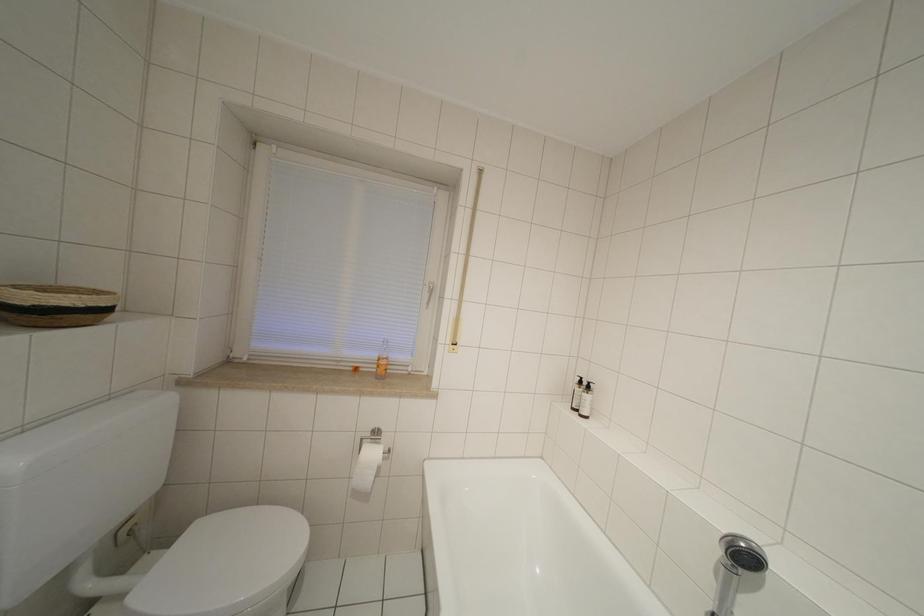
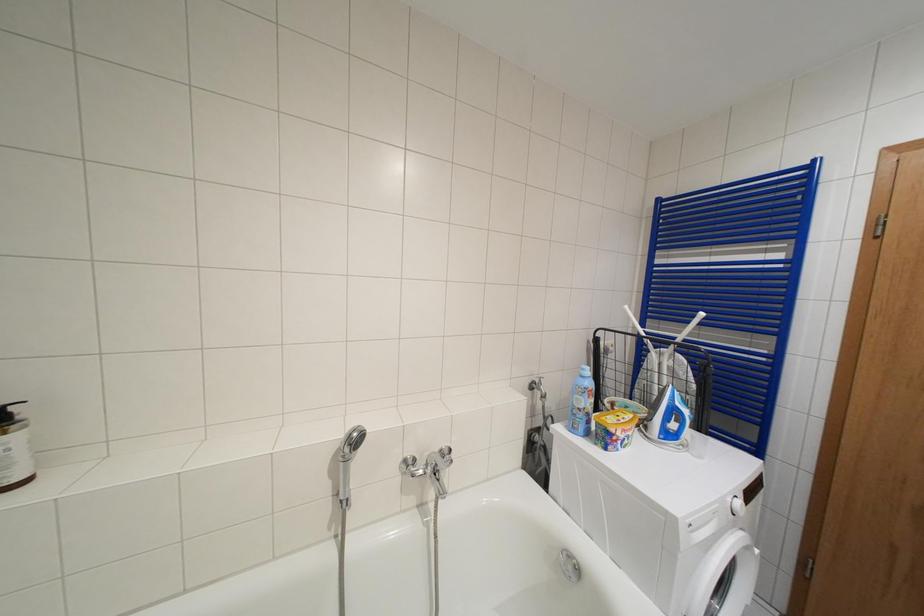
Question: The first image is from the beginning of the video and the second image is from the end. How did the camera likely rotate when shooting the video?

Choices:
 (A) Left
 (B) Right
 (C) Up
 (D) Down

Answer: (B)